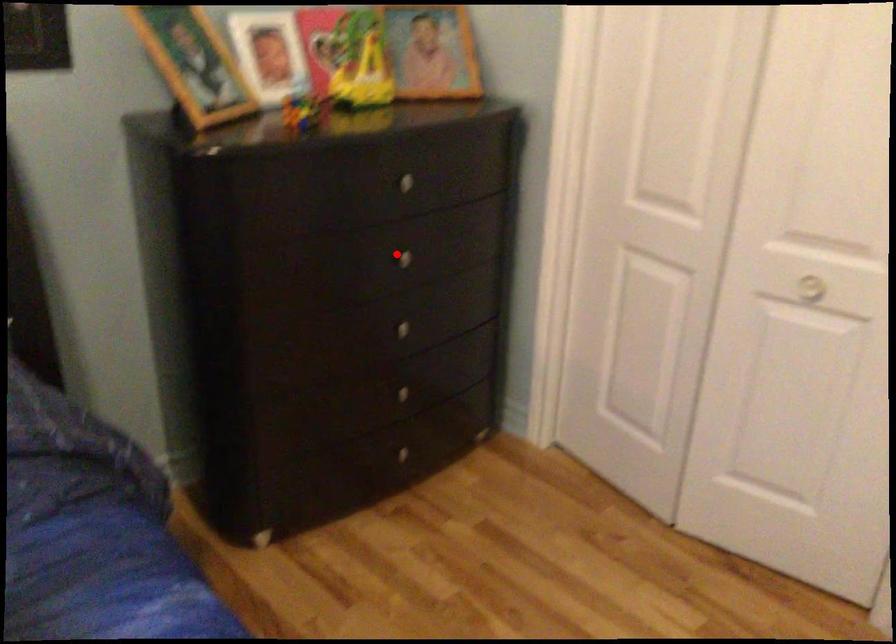
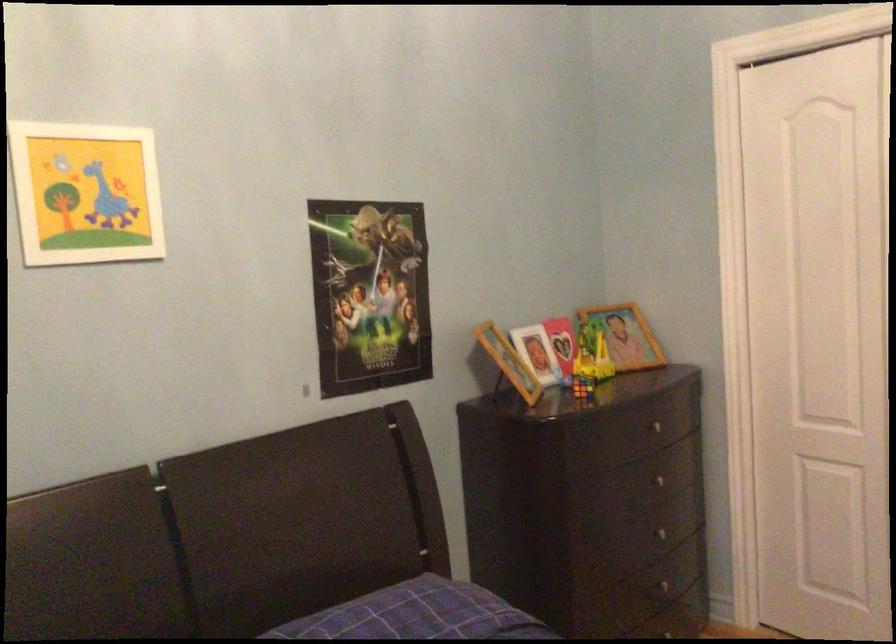
Where in the second image is the point corresponding to the highlighted location from the first image?

(656, 480)